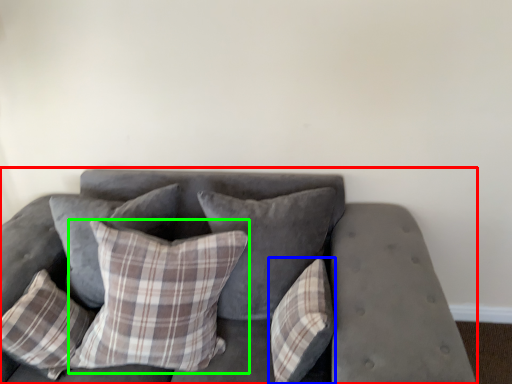
Question: Considering the real-world distances, which object is closest to studio couch (highlighted by a red box)? pillow (highlighted by a blue box) or pillow (highlighted by a green box).

Choices:
 (A) pillow
 (B) pillow

Answer: (A)